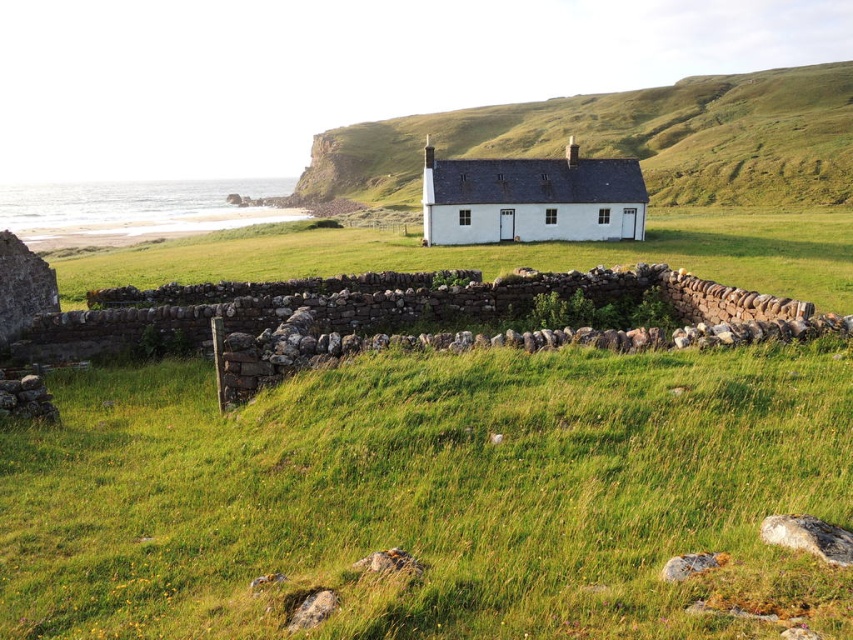
You are standing in the middle of the green grassy field at center and want to reach the white painted wood cottage at center. Which direction should you move to get closer to the cottage?

Since the green grassy field at center is in front of the white painted wood cottage at center, you should move backward to get closer to the cottage.

You are standing at the base of the hill in the rural landscape scene. You see two points marked on the image. The first point is at coordinate point(412, 481) and the second is at point(457, 221). If you were to walk towards the house, which point would you encounter first?

Point(412, 481) is in front of point(457, 221), so you would encounter point(412, 481) first when walking towards the house.